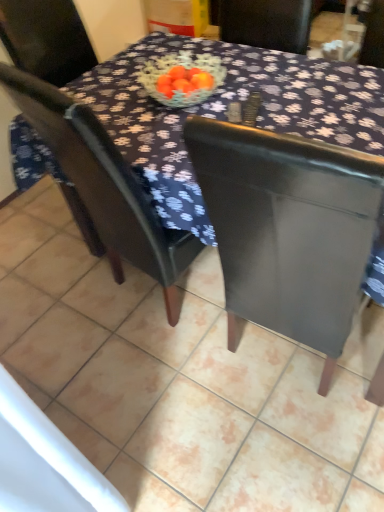
What is the approximate height of matte black table at center?

It is 1.82 inches.

The height and width of the screenshot is (512, 384). What are the coordinates of `matte black table at center` in the screenshot? It's located at (182, 380).

Which object is thinner, dark fabric table at center or matte black table at center?

dark fabric table at center is thinner.

From a real-world perspective, which is physically below, dark fabric table at center or matte black table at center?

In real-world perspective, matte black table at center is lower.

You are a GUI agent. You are given a task and a screenshot of the screen. Output one action in this format:
    pyautogui.click(x=<x>, y=<y>)
    Task: Click on the table located above the matte black table at center (from a real-world perspective)
    The width and height of the screenshot is (384, 512).
    Given the screenshot: What is the action you would take?
    pyautogui.click(x=288, y=228)

Is dark fabric table at center in contact with matte black table at center?

There is a gap between dark fabric table at center and matte black table at center.

Find the location of `table in front of the matte black chair at center`. table in front of the matte black chair at center is located at coordinates (288, 228).

Looking at this image, from the image's perspective, is matte black chair at center located beneath dark fabric table at center?

Actually, matte black chair at center appears above dark fabric table at center in the image.

Is matte black chair at center taller than dark fabric table at center?

Yes, matte black chair at center is taller than dark fabric table at center.

Does matte black table at center turn towards matte black chair at center?

No.

I want to click on chair on the left side of matte black table at center, so click(104, 187).

Is matte black table at center beside matte black chair at center?

No.

Measure the distance from matte black chair at center to matte black table at center.

They are 47.09 centimeters apart.

From the image's perspective, which one is positioned lower, matte black chair at center or matte black table at center?

matte black table at center.

Can we say matte black chair at center lies outside matte black table at center?

Indeed, matte black chair at center is completely outside matte black table at center.

Is point (116, 249) closer to viewer compared to point (222, 365)?

No, (116, 249) is further to viewer.

Considering the relative positions of dark fabric table at center and matte black chair at center in the image provided, is dark fabric table at center to the left of matte black chair at center from the viewer's perspective?

Incorrect, dark fabric table at center is not on the left side of matte black chair at center.

Considering the relative sizes of dark fabric table at center and matte black chair at center in the image provided, is dark fabric table at center smaller than matte black chair at center?

Actually, dark fabric table at center might be larger than matte black chair at center.

Considering the points (325, 272) and (68, 170), which point is behind, point (325, 272) or point (68, 170)?

The point (68, 170) is behind.

Does matte black table at center appear on the right side of dark fabric table at center?

In fact, matte black table at center is to the left of dark fabric table at center.

Is matte black table at center oriented away from dark fabric table at center?

That's not correct — matte black table at center is not looking away from dark fabric table at center.

Can you see matte black table at center touching dark fabric table at center?

No, matte black table at center is not with dark fabric table at center.

Is dark fabric table at center completely or partially inside matte black table at center?

Actually, dark fabric table at center is outside matte black table at center.

Find the location of `tile located underneath the dark fabric table at center (from a real-world perspective)`. tile located underneath the dark fabric table at center (from a real-world perspective) is located at coordinates (182, 380).

Where is `chair that is behind the dark fabric table at center`? The width and height of the screenshot is (384, 512). chair that is behind the dark fabric table at center is located at coordinates (104, 187).

Looking at the image, which one is located closer to matte black table at center, matte black chair at center or dark fabric table at center?

matte black chair at center.

Estimate the real-world distances between objects in this image. Which object is closer to matte black table at center, dark fabric table at center or matte black chair at center?

Based on the image, matte black chair at center appears to be nearer to matte black table at center.

From the image, which object appears to be farther from dark fabric table at center, matte black table at center or matte black chair at center?

matte black table at center.

Which object lies nearer to the anchor point matte black chair at center, dark fabric table at center or matte black table at center?

dark fabric table at center.

Looking at the image, which one is located further to matte black chair at center, matte black table at center or dark fabric table at center?

Among the two, matte black table at center is located further to matte black chair at center.

Estimate the real-world distances between objects in this image. Which object is further from dark fabric table at center, matte black chair at center or matte black table at center?

matte black table at center.

The height and width of the screenshot is (512, 384). Identify the location of table between matte black chair at center and matte black table at center in the up-down direction. (288, 228).